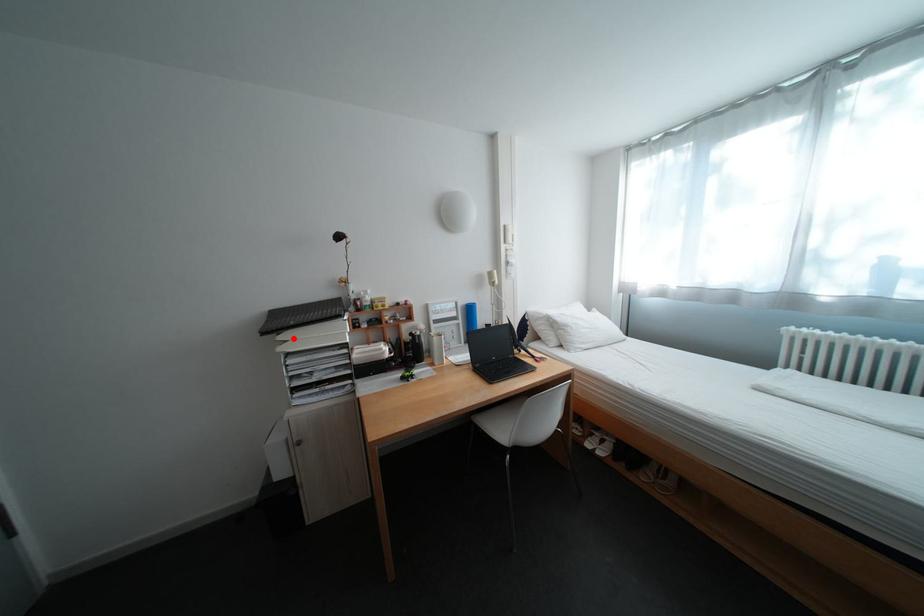
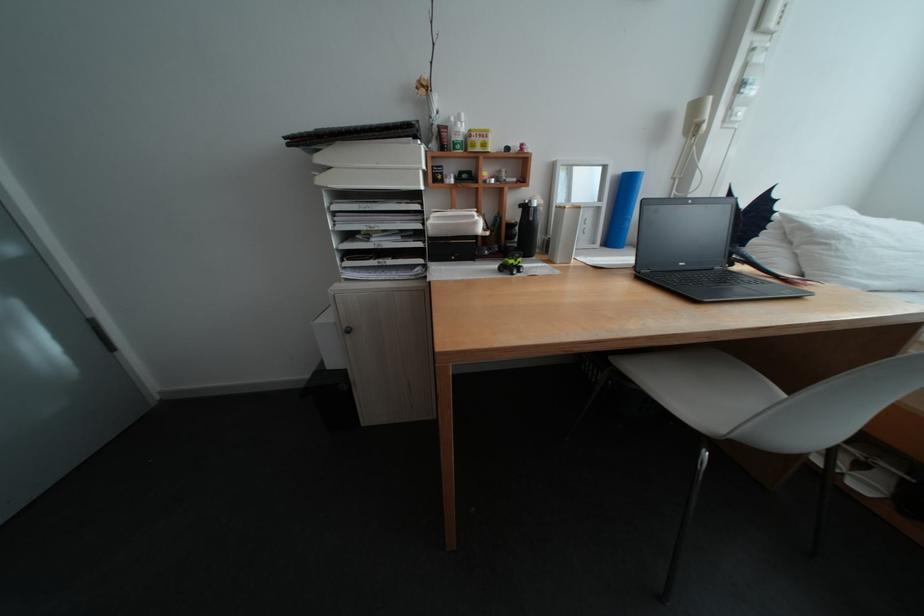
Where in the second image is the point corresponding to the highlighted location from the first image?

(333, 160)